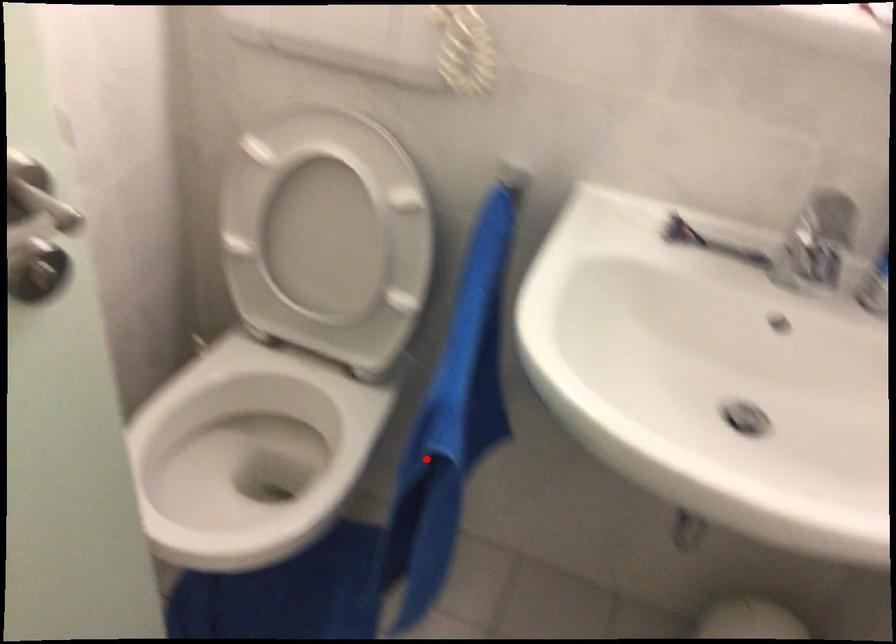
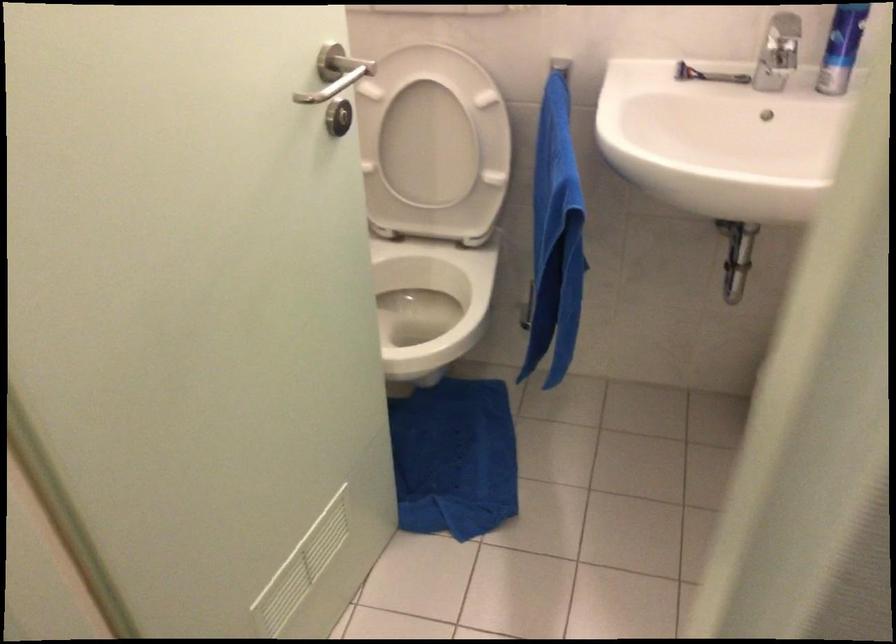
Question: I am providing you with two images of the same scene from different viewpoints. A red point is shown in image1. For the corresponding object point in image2, is it positioned nearer or farther from the camera?

Choices:
 (A) Nearer
 (B) Farther

Answer: (B)